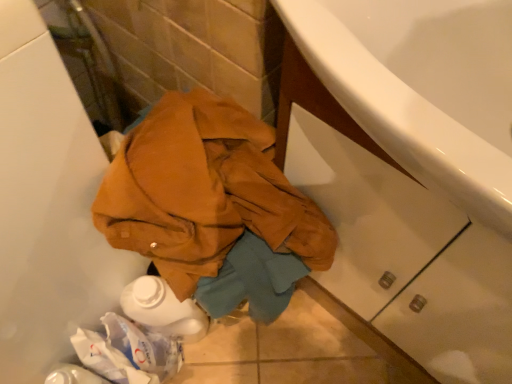
Describe the element at coordinates (212, 207) in the screenshot. I see `leather jacket at center` at that location.

Where is `leather jacket at center`? leather jacket at center is located at coordinates (212, 207).

You are a GUI agent. You are given a task and a screenshot of the screen. Output one action in this format:
    pyautogui.click(x=<x>, y=<y>)
    Task: Click on the white glossy cabinet at lower right
    Image resolution: width=512 pixels, height=384 pixels.
    Given the screenshot: What is the action you would take?
    pyautogui.click(x=413, y=170)

Looking at this image, what is the approximate width of white glossy cabinet at lower right?

white glossy cabinet at lower right is 14.47 inches in width.

What do you see at coordinates (413, 170) in the screenshot?
I see `white glossy cabinet at lower right` at bounding box center [413, 170].

Identify the location of leather jacket at center. The height and width of the screenshot is (384, 512). (212, 207).

Does leather jacket at center appear on the left side of white glossy cabinet at lower right?

Yes.

Does leather jacket at center lie in front of white glossy cabinet at lower right?

No, it is behind white glossy cabinet at lower right.

Does point (305, 238) lie in front of point (353, 235)?

Yes, it is in front of point (353, 235).

From the image's perspective, between leather jacket at center and white glossy cabinet at lower right, which one is located above?

white glossy cabinet at lower right, from the image's perspective.

Consider the image. From a real-world perspective, relative to white glossy cabinet at lower right, is leather jacket at center vertically above or below?

leather jacket at center is situated lower than white glossy cabinet at lower right in the real world.

Considering the relative sizes of leather jacket at center and white glossy cabinet at lower right in the image provided, is leather jacket at center wider than white glossy cabinet at lower right?

No, leather jacket at center is not wider than white glossy cabinet at lower right.

Considering the sizes of objects leather jacket at center and white glossy cabinet at lower right in the image provided, who is taller, leather jacket at center or white glossy cabinet at lower right?

white glossy cabinet at lower right is taller.

Who is bigger, leather jacket at center or white glossy cabinet at lower right?

Bigger between the two is white glossy cabinet at lower right.

Is leather jacket at center outside of white glossy cabinet at lower right?

leather jacket at center lies outside white glossy cabinet at lower right's area.

Is leather jacket at center far away from white glossy cabinet at lower right?

They are positioned close to each other.

Based on the photo, could you tell me if leather jacket at center is facing white glossy cabinet at lower right?

No, leather jacket at center is not facing towards white glossy cabinet at lower right.

How many degrees apart are the facing directions of leather jacket at center and white glossy cabinet at lower right?

They differ by 1.49 degrees in their facing directions.

Locate an element on the screen. clothing below the white glossy cabinet at lower right (from a real-world perspective) is located at coordinates (212, 207).

Considering the relative positions of white glossy cabinet at lower right and leather jacket at center in the image provided, is white glossy cabinet at lower right to the right of leather jacket at center from the viewer's perspective?

Yes.

From the picture: Which object is more forward, white glossy cabinet at lower right or leather jacket at center?

Positioned in front is white glossy cabinet at lower right.

Considering the positions of points (440, 324) and (213, 171), is point (440, 324) farther from camera compared to point (213, 171)?

Yes, point (440, 324) is behind point (213, 171).

From the image's perspective, does white glossy cabinet at lower right appear higher than leather jacket at center?

Correct, white glossy cabinet at lower right appears higher than leather jacket at center in the image.

From a real-world perspective, who is located lower, white glossy cabinet at lower right or leather jacket at center?

In real-world perspective, leather jacket at center is lower.

Considering the relative sizes of white glossy cabinet at lower right and leather jacket at center in the image provided, is white glossy cabinet at lower right thinner than leather jacket at center?

In fact, white glossy cabinet at lower right might be wider than leather jacket at center.

Does white glossy cabinet at lower right have a lesser height compared to leather jacket at center?

No.

From the picture: Who is smaller, white glossy cabinet at lower right or leather jacket at center?

leather jacket at center is smaller.

Which is correct: white glossy cabinet at lower right is inside leather jacket at center, or outside of it?

white glossy cabinet at lower right is spatially situated outside leather jacket at center.

Is white glossy cabinet at lower right far from leather jacket at center?

white glossy cabinet at lower right is near leather jacket at center, not far away.

Based on the photo, is white glossy cabinet at lower right facing away from leather jacket at center?

white glossy cabinet at lower right is not turned away from leather jacket at center.

What's the angular difference between white glossy cabinet at lower right and leather jacket at center's facing directions?

There is a 1.49-degree angle between the facing directions of white glossy cabinet at lower right and leather jacket at center.

Locate an element on the screen. The width and height of the screenshot is (512, 384). clothing below the white glossy cabinet at lower right (from a real-world perspective) is located at coordinates (212, 207).

At what (x,y) coordinates should I click in order to perform the action: click on clothing below the white glossy cabinet at lower right (from a real-world perspective). Please return your answer as a coordinate pair (x, y). Looking at the image, I should click on coord(212,207).

Where is `bathroom cabinet located on the right of leather jacket at center`? The width and height of the screenshot is (512, 384). bathroom cabinet located on the right of leather jacket at center is located at coordinates (413, 170).